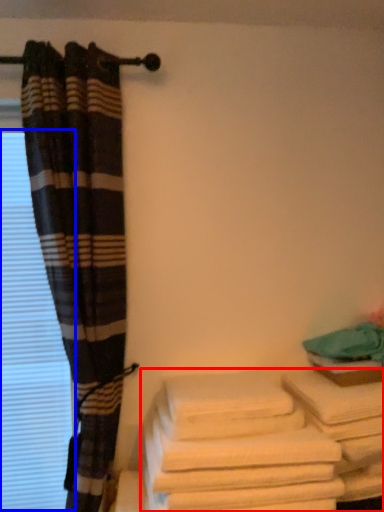
Question: Which point is closer to the camera, towel (highlighted by a red box) or window (highlighted by a blue box)?

Choices:
 (A) towel
 (B) window

Answer: (A)